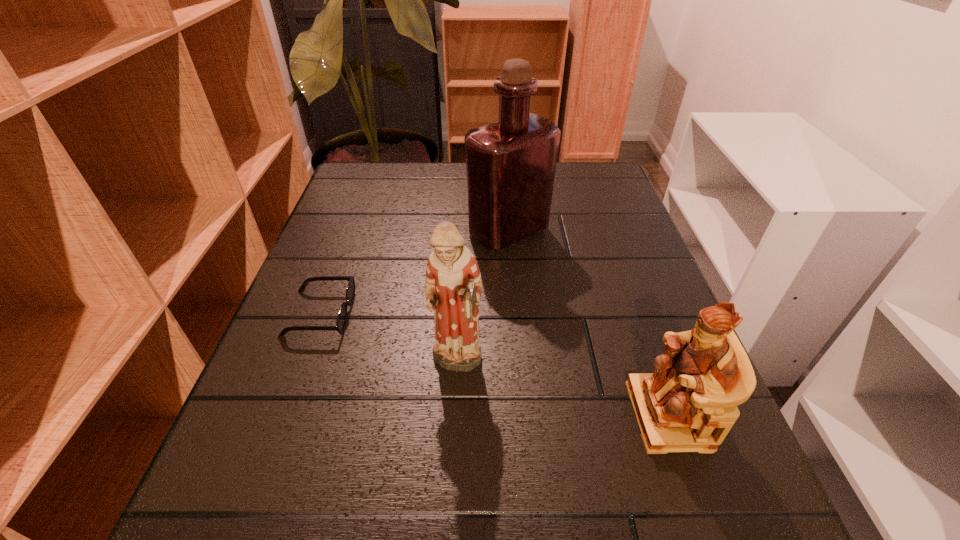
Locate an element on the screen. Image resolution: width=960 pixels, height=540 pixels. vacant space that's between the rightmost object and the farthest object is located at coordinates (588, 323).

Select which object is the third closest to the rightmost object. Please provide its 2D coordinates. Your answer should be formatted as a tuple, i.e. [(x, y)], where the tuple contains the x and y coordinates of a point satisfying the conditions above.

[(341, 320)]

Identify which object is the second closest to the left figurine. Please provide its 2D coordinates. Your answer should be formatted as a tuple, i.e. [(x, y)], where the tuple contains the x and y coordinates of a point satisfying the conditions above.

[(689, 403)]